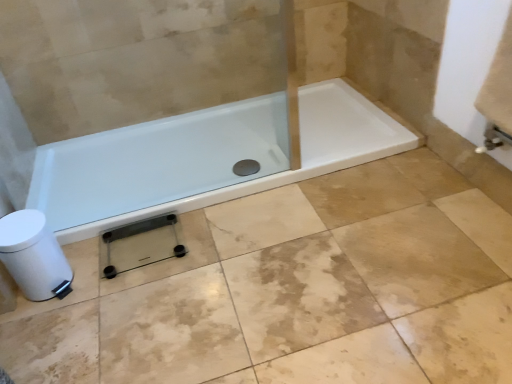
Where is `transparent glass scale at center`? transparent glass scale at center is located at coordinates (172, 259).

The image size is (512, 384). What do you see at coordinates (172, 259) in the screenshot?
I see `transparent glass scale at center` at bounding box center [172, 259].

At what (x,y) coordinates should I click in order to perform the action: click on transparent glass scale at center. Please return your answer as a coordinate pair (x, y). This screenshot has width=512, height=384. Looking at the image, I should click on (172, 259).